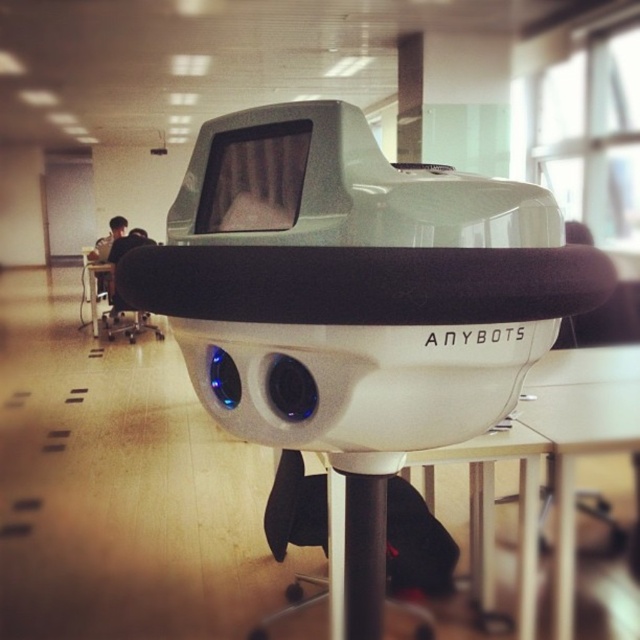
Question: Which of the following is the closest to the observer?

Choices:
 (A) (141, 330)
 (B) (138, 275)

Answer: (B)

Question: Is white matte anybots at center positioned behind matte black chair at left?

Choices:
 (A) yes
 (B) no

Answer: (B)

Question: Does white matte anybots at center appear on the left side of matte black chair at left?

Choices:
 (A) no
 (B) yes

Answer: (A)

Question: Which of the following is the closest to the observer?

Choices:
 (A) matte black chair at left
 (B) white matte anybots at center

Answer: (B)

Question: Does white matte anybots at center appear under matte black chair at left?

Choices:
 (A) no
 (B) yes

Answer: (B)

Question: Among these points, which one is nearest to the camera?

Choices:
 (A) (116, 310)
 (B) (476, 288)

Answer: (B)